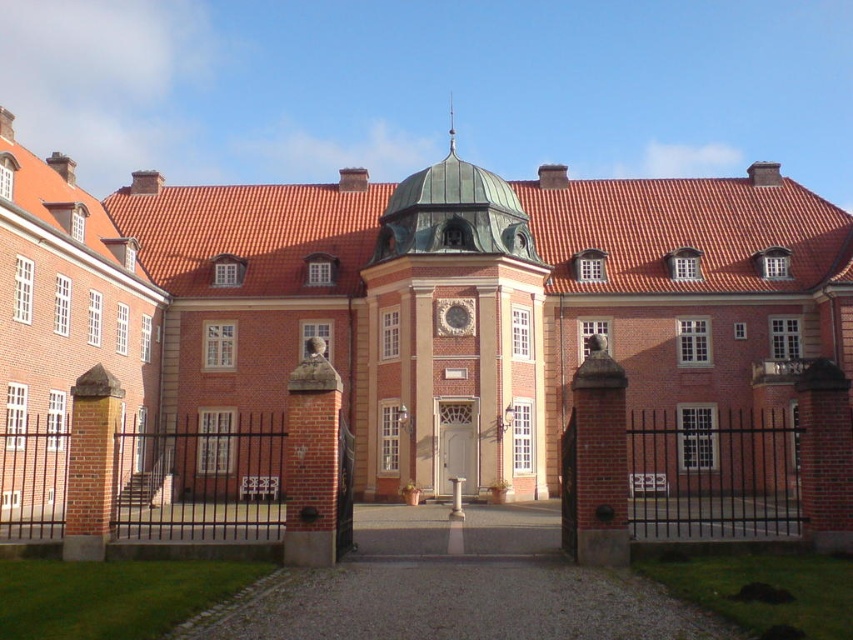
You are a tour guide explaining the architecture of the red brick building at center and the white wooden door at center. Which one is bigger in size?

The red brick building at center is larger in size compared to the white wooden door at center.

Looking at this image, you are standing in front of the historic building and want to enter through the entrance. Which side of the white wooden door at center is the red brick building at center located on?

The red brick building at center is located to the right of the white wooden door at center, so the building is on the right side of the door.